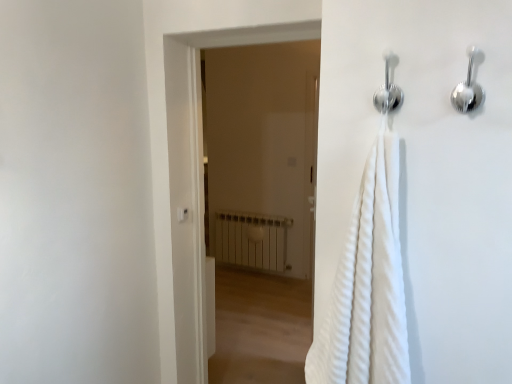
Describe the element at coordinates (469, 86) in the screenshot. I see `satin silver shower at upper right, the 1th shower when ordered from right to left` at that location.

What is the approximate width of white matte radiator at center?

3.93 inches.

What is the approximate height of white matte radiator at center?

white matte radiator at center is 6.07 feet tall.

The height and width of the screenshot is (384, 512). Find the location of `white plastic light switch at upper center`. white plastic light switch at upper center is located at coordinates 182,214.

Image resolution: width=512 pixels, height=384 pixels. What are the coordinates of `chrome metallic shower at upper center, the first shower from the left` in the screenshot? It's located at (x=388, y=89).

Considering the relative sizes of satin silver shower at upper right, which appears as the second shower when viewed from the left, and white matte radiator at center in the image provided, is satin silver shower at upper right, which appears as the second shower when viewed from the left, thinner than white matte radiator at center?

Indeed, satin silver shower at upper right, which appears as the second shower when viewed from the left, has a lesser width compared to white matte radiator at center.

What's the angular difference between satin silver shower at upper right, the 1th shower when ordered from right to left, and white matte radiator at center's facing directions?

0.892 degrees.

Considering the sizes of objects satin silver shower at upper right, which appears as the second shower when viewed from the left, and white matte radiator at center in the image provided, who is shorter, satin silver shower at upper right, which appears as the second shower when viewed from the left, or white matte radiator at center?

satin silver shower at upper right, which appears as the second shower when viewed from the left.

Is satin silver shower at upper right, which appears as the second shower when viewed from the left, oriented towards white matte radiator at center?

No, satin silver shower at upper right, which appears as the second shower when viewed from the left, is not aimed at white matte radiator at center.

Is white plastic light switch at upper center bigger than satin silver shower at upper right, which appears as the second shower when viewed from the left?

Incorrect, white plastic light switch at upper center is not larger than satin silver shower at upper right, which appears as the second shower when viewed from the left.

Is white plastic light switch at upper center closer to the viewer compared to satin silver shower at upper right, the 1th shower when ordered from right to left?

No, it is not.

Does white plastic light switch at upper center have a lesser width compared to satin silver shower at upper right, the 1th shower when ordered from right to left?

Correct, the width of white plastic light switch at upper center is less than that of satin silver shower at upper right, the 1th shower when ordered from right to left.

From the image's perspective, is white plastic light switch at upper center on top of satin silver shower at upper right, the 1th shower when ordered from right to left?

No, from the image's perspective, white plastic light switch at upper center is not above satin silver shower at upper right, the 1th shower when ordered from right to left.

Between white plastic light switch at upper center and white matte radiator at center, which one appears on the right side from the viewer's perspective?

white matte radiator at center is more to the right.

Looking at this image, between white plastic light switch at upper center and white matte radiator at center, which one has smaller size?

white plastic light switch at upper center is smaller.

From a real-world perspective, relative to white matte radiator at center, is white plastic light switch at upper center vertically above or below?

From a real-world perspective, white plastic light switch at upper center is physically above white matte radiator at center.

Considering the positions of point (184, 210) and point (281, 310), is point (184, 210) closer or farther from the camera than point (281, 310)?

Point (184, 210).

You are a GUI agent. You are given a task and a screenshot of the screen. Output one action in this format:
    pyautogui.click(x=<x>, y=<y>)
    Task: Click on the radiator below the chrome metallic shower at upper center, which appears as the second shower when viewed from the right (from the image's perspective)
    The width and height of the screenshot is (512, 384).
    Given the screenshot: What is the action you would take?
    pyautogui.click(x=252, y=240)

Consider the image. From a real-world perspective, is white matte radiator at center physically above chrome metallic shower at upper center, the first shower from the left?

No.

Between white matte radiator at center and chrome metallic shower at upper center, which appears as the second shower when viewed from the right, which one has more height?

With more height is white matte radiator at center.

Is white matte radiator at center further to the viewer compared to chrome metallic shower at upper center, which appears as the second shower when viewed from the right?

Yes, white matte radiator at center is further from the viewer.

Is white matte radiator at center bigger or smaller than white plastic light switch at upper center?

Considering their sizes, white matte radiator at center takes up more space than white plastic light switch at upper center.

From a real-world perspective, is white matte radiator at center beneath white plastic light switch at upper center?

Yes, from a real-world perspective, white matte radiator at center is under white plastic light switch at upper center.

Looking at this image, would you say white plastic light switch at upper center is part of white matte radiator at center's contents?

That's incorrect, white plastic light switch at upper center is not inside white matte radiator at center.

How many degrees apart are the facing directions of white matte radiator at center and white plastic light switch at upper center?

The angle between the facing direction of white matte radiator at center and the facing direction of white plastic light switch at upper center is 88.9 degrees.

Is white matte radiator at center next to chrome metallic shower at upper center, which appears as the second shower when viewed from the right?

white matte radiator at center is not next to chrome metallic shower at upper center, which appears as the second shower when viewed from the right, and they're not touching.

From the image's perspective, is white matte radiator at center beneath chrome metallic shower at upper center, which appears as the second shower when viewed from the right?

Correct, white matte radiator at center appears lower than chrome metallic shower at upper center, which appears as the second shower when viewed from the right, in the image.

Which is behind, point (290, 262) or point (386, 60)?

Point (290, 262)

Is white matte radiator at center looking in the opposite direction of chrome metallic shower at upper center, which appears as the second shower when viewed from the right?

white matte radiator at center does not have its back to chrome metallic shower at upper center, which appears as the second shower when viewed from the right.

Can you confirm if chrome metallic shower at upper center, which appears as the second shower when viewed from the right, is positioned to the left of white plastic light switch at upper center?

Incorrect, chrome metallic shower at upper center, which appears as the second shower when viewed from the right, is not on the left side of white plastic light switch at upper center.

Considering the points (391, 98) and (186, 208), which point is behind, point (391, 98) or point (186, 208)?

The point (186, 208) is behind.

Where is `shower that is the 2nd object above the white plastic light switch at upper center (from a real-world perspective)`? The width and height of the screenshot is (512, 384). shower that is the 2nd object above the white plastic light switch at upper center (from a real-world perspective) is located at coordinates (388, 89).

This screenshot has height=384, width=512. In the image, there is a satin silver shower at upper right, which appears as the second shower when viewed from the left. In order to click on radiator below it (from a real-world perspective) in this screenshot , I will do `click(252, 240)`.

At what (x,y) coordinates should I click in order to perform the action: click on the 1st shower positioned above the white plastic light switch at upper center (from the image's perspective). Please return your answer as a coordinate pair (x, y). Looking at the image, I should click on (469, 86).

From the image, which object appears to be farther from white matte radiator at center, chrome metallic shower at upper center, the first shower from the left, or white matte radiator at center?

chrome metallic shower at upper center, the first shower from the left, is further to white matte radiator at center.

Considering their positions, is chrome metallic shower at upper center, which appears as the second shower when viewed from the right, positioned closer to white plastic light switch at upper center than white matte radiator at center?

The object closer to white plastic light switch at upper center is chrome metallic shower at upper center, which appears as the second shower when viewed from the right.

Consider the image. Which object lies nearer to the anchor point white matte radiator at center, chrome metallic shower at upper center, which appears as the second shower when viewed from the right, or white plastic light switch at upper center?

Among the two, white plastic light switch at upper center is located nearer to white matte radiator at center.

Estimate the real-world distances between objects in this image. Which object is further from satin silver shower at upper right, the 1th shower when ordered from right to left, white plastic light switch at upper center or white matte radiator at center?

white matte radiator at center is further to satin silver shower at upper right, the 1th shower when ordered from right to left.

Which object lies further to the anchor point white plastic light switch at upper center, white matte radiator at center or satin silver shower at upper right, the 1th shower when ordered from right to left?

white matte radiator at center is further to white plastic light switch at upper center.

Based on their spatial positions, is chrome metallic shower at upper center, the first shower from the left, or white plastic light switch at upper center closer to satin silver shower at upper right, the 1th shower when ordered from right to left?

Based on the image, chrome metallic shower at upper center, the first shower from the left, appears to be nearer to satin silver shower at upper right, the 1th shower when ordered from right to left.

From the picture: When comparing their distances from white matte radiator at center, does satin silver shower at upper right, which appears as the second shower when viewed from the left, or white matte radiator at center seem further?

satin silver shower at upper right, which appears as the second shower when viewed from the left, lies further to white matte radiator at center than the other object.

When comparing their distances from white matte radiator at center, does white plastic light switch at upper center or white matte radiator at center seem further?

The object further to white matte radiator at center is white plastic light switch at upper center.

I want to click on screen door between satin silver shower at upper right, which appears as the second shower when viewed from the left, and white matte radiator at center in the front-back direction, so click(x=261, y=206).

You are a GUI agent. You are given a task and a screenshot of the screen. Output one action in this format:
    pyautogui.click(x=<x>, y=<y>)
    Task: Click on the screen door positioned between chrome metallic shower at upper center, the first shower from the left, and white plastic light switch at upper center from near to far
    The height and width of the screenshot is (384, 512).
    Given the screenshot: What is the action you would take?
    pyautogui.click(x=261, y=206)

This screenshot has width=512, height=384. What are the coordinates of `light switch located between white matte radiator at center and white matte radiator at center in the depth direction` in the screenshot? It's located at (182, 214).

Identify the location of screen door positioned between satin silver shower at upper right, which appears as the second shower when viewed from the left, and white plastic light switch at upper center from near to far. This screenshot has width=512, height=384. (261, 206).